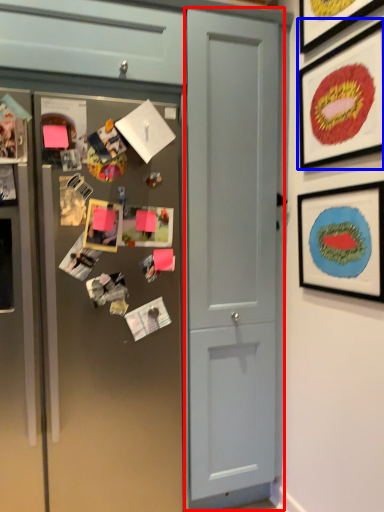
Question: Which point is further to the camera, door (highlighted by a red box) or picture frame (highlighted by a blue box)?

Choices:
 (A) door
 (B) picture frame

Answer: (A)